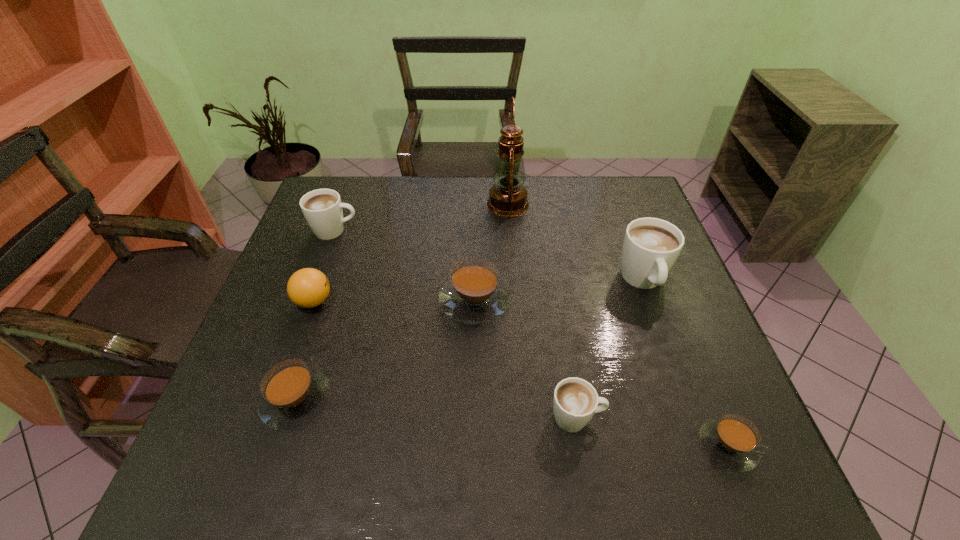
Identify the location of the second closest brown cappuccino to the second biggest brown cappuccino. (732, 441).

You are a GUI agent. You are given a task and a screenshot of the screen. Output one action in this format:
    pyautogui.click(x=<x>, y=<y>)
    Task: Click on the vacant position in the image that satisfies the following two spatial constraints: 1. with the handle on the side of the farthest white cappuccino; 2. on the back side of the shortest object
    
    Given the screenshot: What is the action you would take?
    pyautogui.click(x=256, y=445)

Locate an element on the screen. This screenshot has height=540, width=960. free space that satisfies the following two spatial constraints: 1. on the side with brand of the ping-pong ball; 2. on the left side of the shortest cappuccino is located at coordinates click(263, 445).

In order to click on free spot that satisfies the following two spatial constraints: 1. with the handle on the side of the smallest white cappuccino; 2. on the left side of the shortest object in this screenshot , I will do `click(581, 445)`.

Where is `blank area in the image that satisfies the following two spatial constraints: 1. on the back side of the leftmost brown cappuccino; 2. on the right side of the oil lamp`? blank area in the image that satisfies the following two spatial constraints: 1. on the back side of the leftmost brown cappuccino; 2. on the right side of the oil lamp is located at coordinates (360, 204).

This screenshot has width=960, height=540. Identify the location of vacant position in the image that satisfies the following two spatial constraints: 1. with the handle on the side of the rightmost white cappuccino; 2. with the handle on the side of the nearest white cappuccino. (693, 418).

Locate an element on the screen. The image size is (960, 540). vacant point that satisfies the following two spatial constraints: 1. on the back side of the smallest brown cappuccino; 2. with the handle on the side of the nearest white cappuccino is located at coordinates (717, 418).

Where is `free spot that satisfies the following two spatial constraints: 1. with the handle on the side of the smallest white cappuccino; 2. on the left side of the rightmost brown cappuccino`? free spot that satisfies the following two spatial constraints: 1. with the handle on the side of the smallest white cappuccino; 2. on the left side of the rightmost brown cappuccino is located at coordinates (581, 445).

Image resolution: width=960 pixels, height=540 pixels. What are the coordinates of `vacant space that satisfies the following two spatial constraints: 1. on the side with brand of the ping-pong ball; 2. on the right side of the shortest object` in the screenshot? It's located at (263, 445).

At what (x,y) coordinates should I click in order to perform the action: click on vacant point that satisfies the following two spatial constraints: 1. with the handle on the side of the shortest object; 2. on the left side of the second biggest white cappuccino. Please return your answer as a coordinate pair (x, y). Looking at the image, I should click on (256, 445).